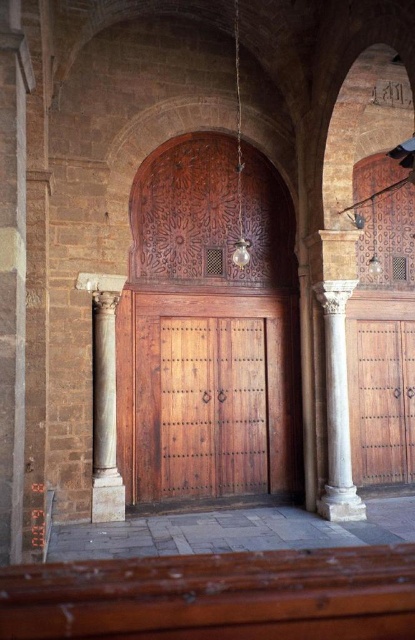
Is polished wood door at right thinner than white marble column at center?

No, polished wood door at right is not thinner than white marble column at center.

Between polished wood door at right and white marble column at center, which one appears on the right side from the viewer's perspective?

polished wood door at right

Between point (376, 401) and point (346, 428), which one is positioned in front?

Point (346, 428)

Find the location of `polished wood door at right`. polished wood door at right is located at coordinates (383, 403).

Can you confirm if wooden door at center is thinner than polished wood door at right?

No.

Which is behind, point (148, 481) or point (363, 401)?

The point (363, 401) is behind.

Where is `wooden door at center`? The image size is (415, 640). wooden door at center is located at coordinates (212, 396).

Which is in front, point (412, 481) or point (100, 481)?

Point (100, 481)

Can you confirm if polished wood door at right is positioned below white marble column at left?

Yes.

Locate an element on the screen. The height and width of the screenshot is (640, 415). polished wood door at right is located at coordinates (383, 403).

The width and height of the screenshot is (415, 640). What are the coordinates of `polished wood door at right` in the screenshot? It's located at (383, 403).